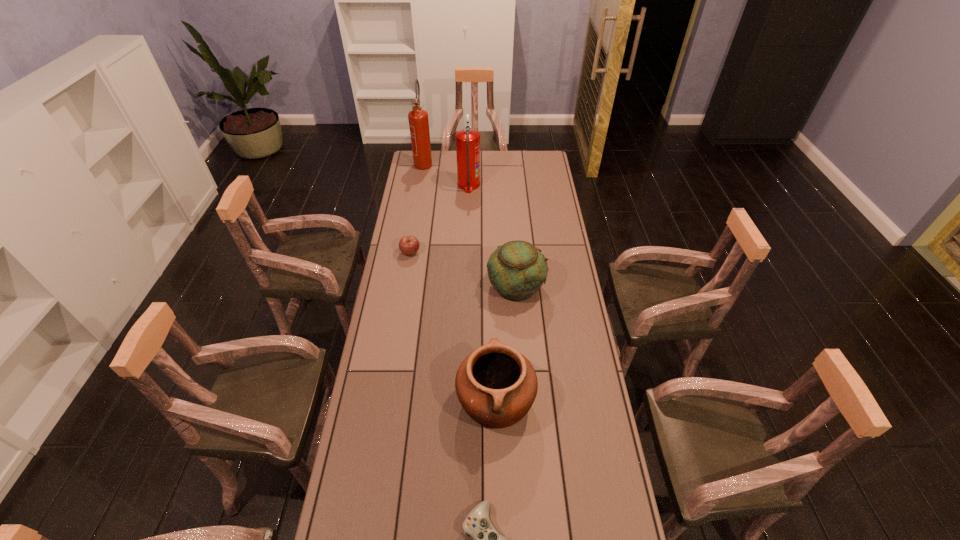
The image size is (960, 540). In order to click on the tallest object in this screenshot , I will do `click(418, 118)`.

You are a GUI agent. You are given a task and a screenshot of the screen. Output one action in this format:
    pyautogui.click(x=<x>, y=<y>)
    Task: Click on the taller fire extinguisher
    
    Given the screenshot: What is the action you would take?
    pyautogui.click(x=418, y=118)

The image size is (960, 540). I want to click on the right fire extinguisher, so click(467, 140).

Where is `the nearer fire extinguisher`? The height and width of the screenshot is (540, 960). the nearer fire extinguisher is located at coordinates (467, 140).

At what (x,y) coordinates should I click in order to perform the action: click on the nearer pottery. Please return your answer as a coordinate pair (x, y). This screenshot has height=540, width=960. Looking at the image, I should click on (496, 385).

This screenshot has width=960, height=540. What are the coordinates of `the third nearest object` in the screenshot? It's located at (517, 269).

Locate an element on the screen. The height and width of the screenshot is (540, 960). the fifth tallest object is located at coordinates (409, 245).

Where is `the third farthest object`? The width and height of the screenshot is (960, 540). the third farthest object is located at coordinates (409, 245).

Where is `vacant space situated 0.170m from the nozzle of the left fire extinguisher`? This screenshot has height=540, width=960. vacant space situated 0.170m from the nozzle of the left fire extinguisher is located at coordinates (420, 190).

I want to click on free point located on the instruction side of the right fire extinguisher, so click(546, 185).